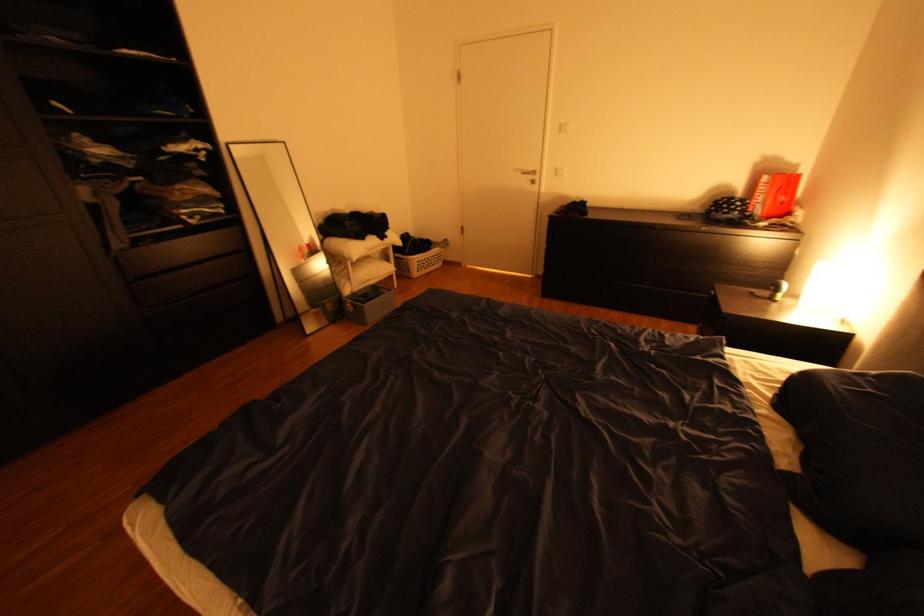
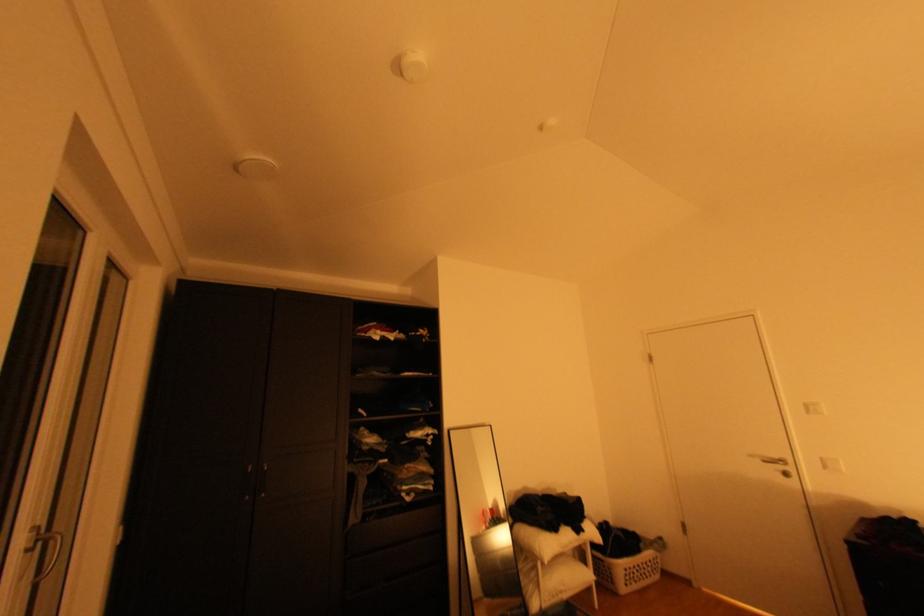
Find the pixel in the second image that matches point (541, 169) in the first image.

(786, 456)